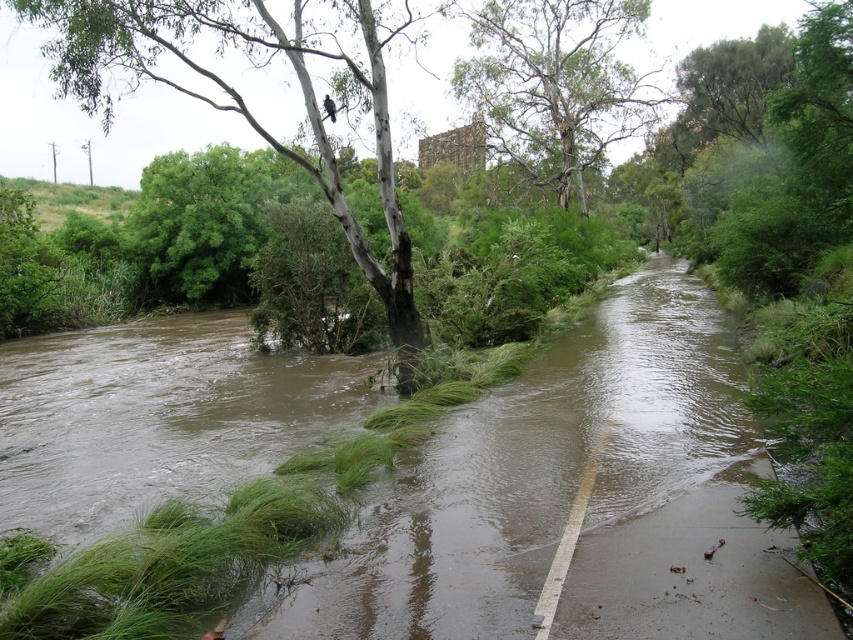
Question: In this image, where is green leafy tree at left located relative to green rough bark tree at upper center?

Choices:
 (A) below
 (B) above

Answer: (A)

Question: Is green leafy tree at left bigger than green rough bark tree at upper center?

Choices:
 (A) yes
 (B) no

Answer: (A)

Question: Among these points, which one is farthest from the camera?

Choices:
 (A) (570, 97)
 (B) (38, 1)

Answer: (A)

Question: Among these points, which one is nearest to the camera?

Choices:
 (A) (625, 33)
 (B) (51, 45)

Answer: (B)

Question: Does green leafy tree at left come behind green rough bark tree at upper center?

Choices:
 (A) no
 (B) yes

Answer: (A)